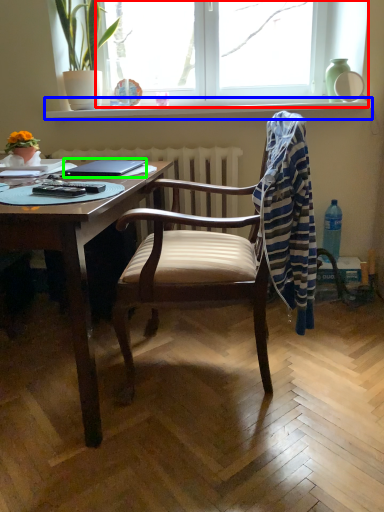
Question: Which is nearer to the window (highlighted by a red box)? window sill (highlighted by a blue box) or laptop (highlighted by a green box).

Choices:
 (A) window sill
 (B) laptop

Answer: (A)